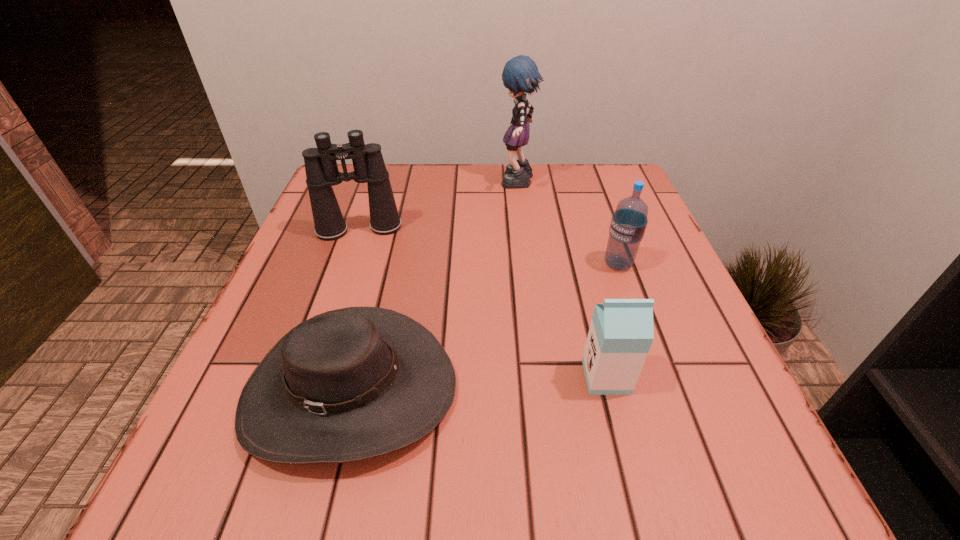
Locate an element on the screen. free spot between the cowboy hat and the milk carton is located at coordinates (478, 383).

Where is `vacant point located between the fourth object from left to right and the binoculars`? This screenshot has height=540, width=960. vacant point located between the fourth object from left to right and the binoculars is located at coordinates (483, 303).

The image size is (960, 540). In order to click on vacant area between the farthest object and the cowboy hat in this screenshot , I will do `click(434, 287)`.

The image size is (960, 540). Identify the location of vacant region between the tallest object and the rightmost object. (567, 224).

This screenshot has width=960, height=540. I want to click on free space between the second farthest object and the milk carton, so click(x=483, y=303).

Find the location of a particular element. the closest object to the rightmost object is located at coordinates (621, 332).

Locate an element on the screen. The image size is (960, 540). object that is the third closest to the rightmost object is located at coordinates (350, 384).

You are a GUI agent. You are given a task and a screenshot of the screen. Output one action in this format:
    pyautogui.click(x=<x>, y=<y>)
    Task: Click on the free location that satisfies the following two spatial constraints: 1. on the front-facing side of the third object from right to left; 2. on the front side of the second farthest object
    
    Given the screenshot: What is the action you would take?
    pyautogui.click(x=523, y=229)

Identify the location of blank space that satisfies the following two spatial constraints: 1. on the front-facing side of the farthest object; 2. on the right side of the fourth object from left to right. Image resolution: width=960 pixels, height=540 pixels. (541, 377).

Locate an element on the screen. free spot that satisfies the following two spatial constraints: 1. on the front-facing side of the rag doll; 2. on the right side of the second object from right to left is located at coordinates (541, 377).